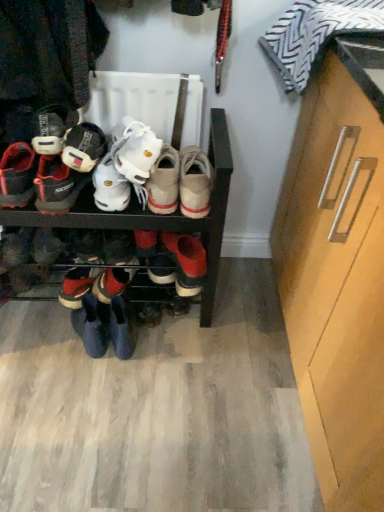
Question: Is striped fabric pillow at upper right positioned in front of white suede sneakers at center, acting as the second footwear starting from the right?

Choices:
 (A) no
 (B) yes

Answer: (B)

Question: Is striped fabric pillow at upper right shorter than white suede sneakers at center, acting as the second footwear starting from the right?

Choices:
 (A) yes
 (B) no

Answer: (B)

Question: Is striped fabric pillow at upper right placed right next to white suede sneakers at center, the fifth footwear from the left?

Choices:
 (A) no
 (B) yes

Answer: (A)

Question: Is there a large distance between striped fabric pillow at upper right and white suede sneakers at center, the fifth footwear from the left?

Choices:
 (A) no
 (B) yes

Answer: (A)

Question: Could you tell me if striped fabric pillow at upper right is turned towards white suede sneakers at center, the fifth footwear from the left?

Choices:
 (A) no
 (B) yes

Answer: (A)

Question: Based on their sizes in the image, would you say striped fabric pillow at upper right is bigger or smaller than matte black shoe at left, which is counted as the 2th footwear, starting from the left?

Choices:
 (A) big
 (B) small

Answer: (A)

Question: From their relative heights in the image, would you say striped fabric pillow at upper right is taller or shorter than matte black shoe at left, which is counted as the 2th footwear, starting from the left?

Choices:
 (A) short
 (B) tall

Answer: (B)

Question: In terms of width, does striped fabric pillow at upper right look wider or thinner when compared to matte black shoe at left, arranged as the 5th footwear when viewed from the right?

Choices:
 (A) thin
 (B) wide

Answer: (B)

Question: From a real-world perspective, is striped fabric pillow at upper right above or below matte black shoe at left, which is counted as the 2th footwear, starting from the left?

Choices:
 (A) below
 (B) above

Answer: (B)

Question: Is light brown wood cabinet at right spatially inside black matte shoe rack at center, or outside of it?

Choices:
 (A) inside
 (B) outside

Answer: (B)

Question: Based on their sizes in the image, would you say light brown wood cabinet at right is bigger or smaller than black matte shoe rack at center?

Choices:
 (A) small
 (B) big

Answer: (B)

Question: Is point (332, 212) positioned closer to the camera than point (223, 137)?

Choices:
 (A) closer
 (B) farther

Answer: (A)

Question: Considering the relative positions of light brown wood cabinet at right and black matte shoe rack at center in the image provided, is light brown wood cabinet at right to the left or to the right of black matte shoe rack at center?

Choices:
 (A) left
 (B) right

Answer: (B)

Question: Considering the positions of black matte shoe rack at center and shiny black sneakers at lower left, acting as the third footwear starting from the left, in the image, is black matte shoe rack at center wider or thinner than shiny black sneakers at lower left, acting as the third footwear starting from the left,?

Choices:
 (A) wide
 (B) thin

Answer: (A)

Question: Is point (175, 229) closer or farther from the camera than point (64, 274)?

Choices:
 (A) farther
 (B) closer

Answer: (B)